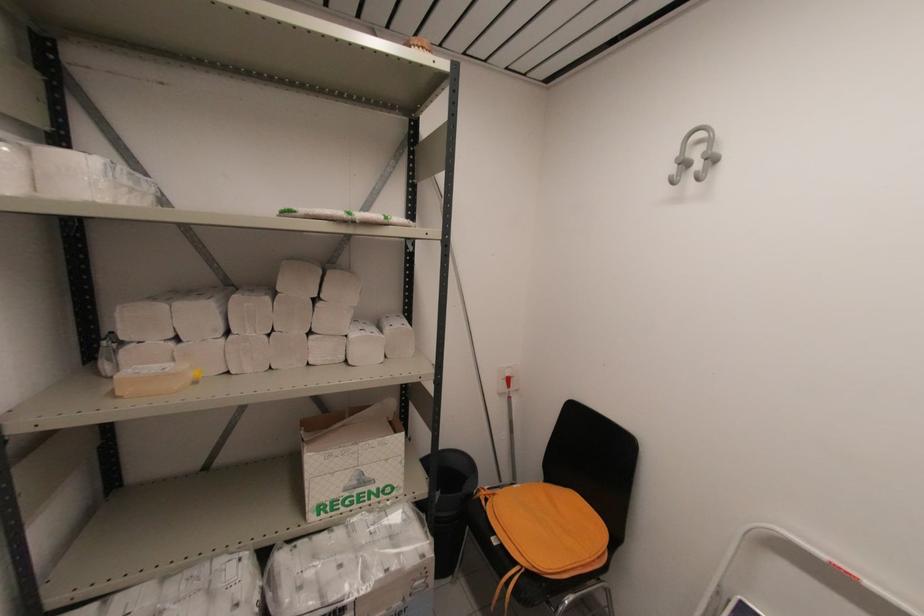
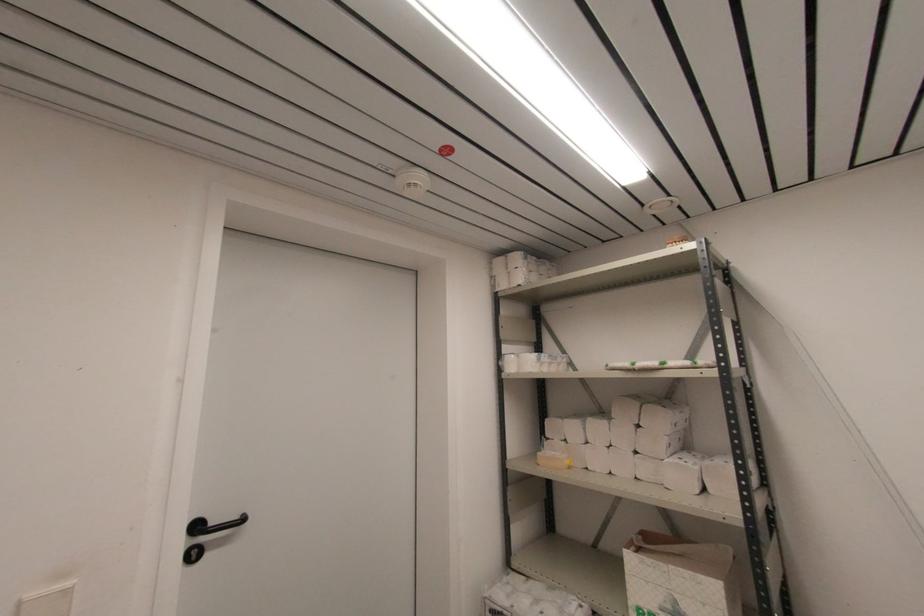
In the second image, find the point that corresponds to (356,483) in the first image.

(671, 609)